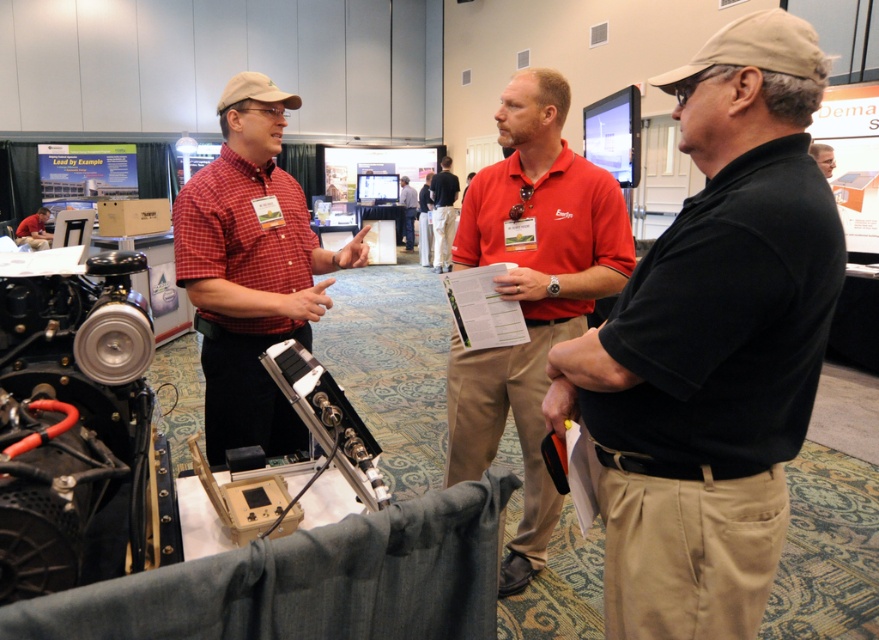
Can you confirm if black matte shirt at center is bigger than red shirt at center?

Incorrect, black matte shirt at center is not larger than red shirt at center.

What do you see at coordinates (713, 346) in the screenshot? This screenshot has height=640, width=879. I see `black matte shirt at center` at bounding box center [713, 346].

Locate an element on the screen. black matte shirt at center is located at coordinates (713, 346).

This screenshot has height=640, width=879. I want to click on black matte shirt at center, so click(713, 346).

Who is more forward, (x=761, y=208) or (x=448, y=163)?

Point (x=761, y=208) is in front.

How far apart are black matte shirt at center and dark blue shirt at center?

They are 8.20 meters apart.

Does point (662, 579) come in front of point (434, 188)?

Yes, it is.

The height and width of the screenshot is (640, 879). What are the coordinates of `black matte shirt at center` in the screenshot? It's located at tap(713, 346).

Can you confirm if dark blue shirt at center is shorter than light brown leather jacket at upper right?

Incorrect, dark blue shirt at center's height does not fall short of light brown leather jacket at upper right's.

Is point (452, 188) less distant than point (823, 145)?

No, (452, 188) is further to viewer.

I want to click on dark blue shirt at center, so click(442, 212).